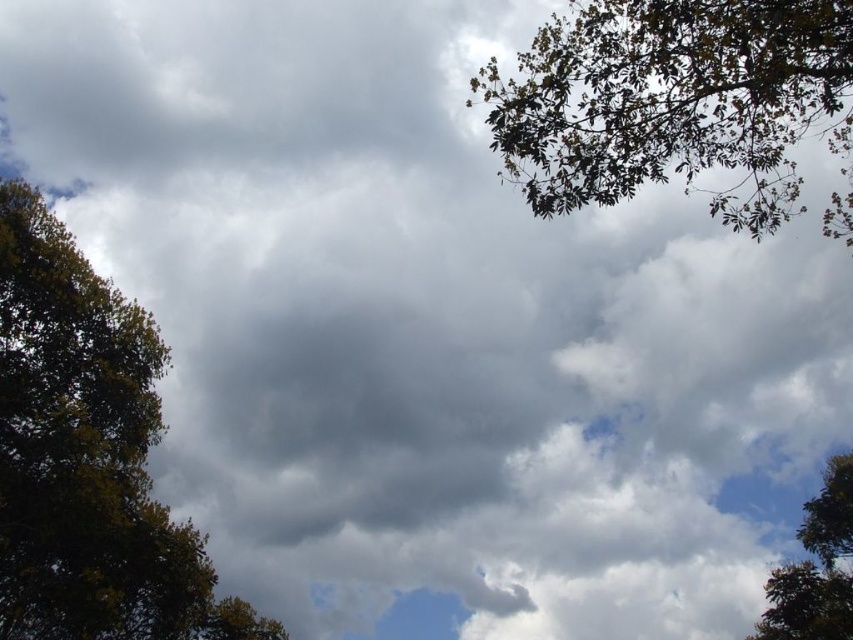
Question: Which of the following is the closest to the observer?

Choices:
 (A) (782, 566)
 (B) (575, 118)

Answer: (B)

Question: Can you confirm if green leafy branches at upper right is positioned to the right of green leafy tree at lower right?

Choices:
 (A) no
 (B) yes

Answer: (A)

Question: Does green leafy tree at left have a smaller size compared to green leafy tree at lower right?

Choices:
 (A) no
 (B) yes

Answer: (A)

Question: Which point appears farthest from the camera in this image?

Choices:
 (A) (573, 208)
 (B) (7, 259)

Answer: (B)

Question: Is the position of green leafy branches at upper right less distant than that of green leafy tree at lower right?

Choices:
 (A) yes
 (B) no

Answer: (A)

Question: Which point is closer to the camera taking this photo?

Choices:
 (A) (813, 573)
 (B) (572, 157)
 (C) (19, 496)

Answer: (B)